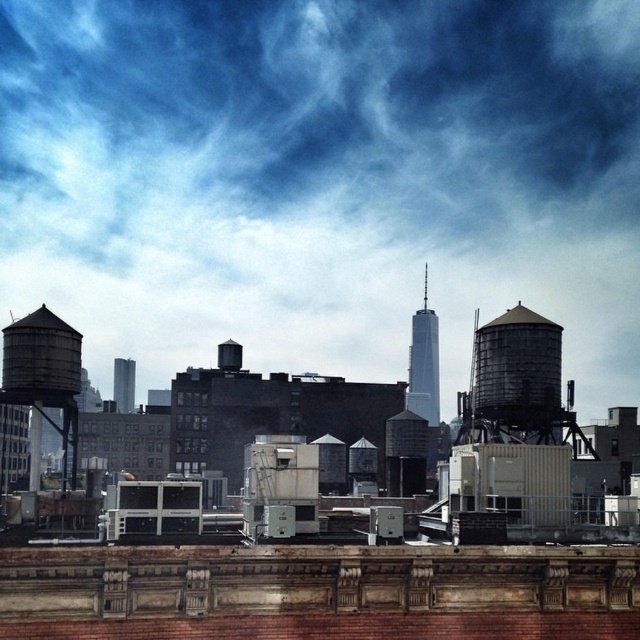
You are a city planner reviewing the urban skyline. You notice the rustic metal water tower at right and the metallic silver water tower at center. Which one is positioned higher in the sky?

The rustic metal water tower at right is located above the metallic silver water tower at center, so it is positioned higher in the sky.

You are standing on a rooftop and want to take a photo of the point at coordinates point (477, 353). If your camera can focus on objects up to 100 meters away, will you be able to capture the point clearly?

The distance of point (477, 353) from the camera is 85.38 meters, which is within the camera focus range of 100 meters. Therefore, you can capture the point clearly.